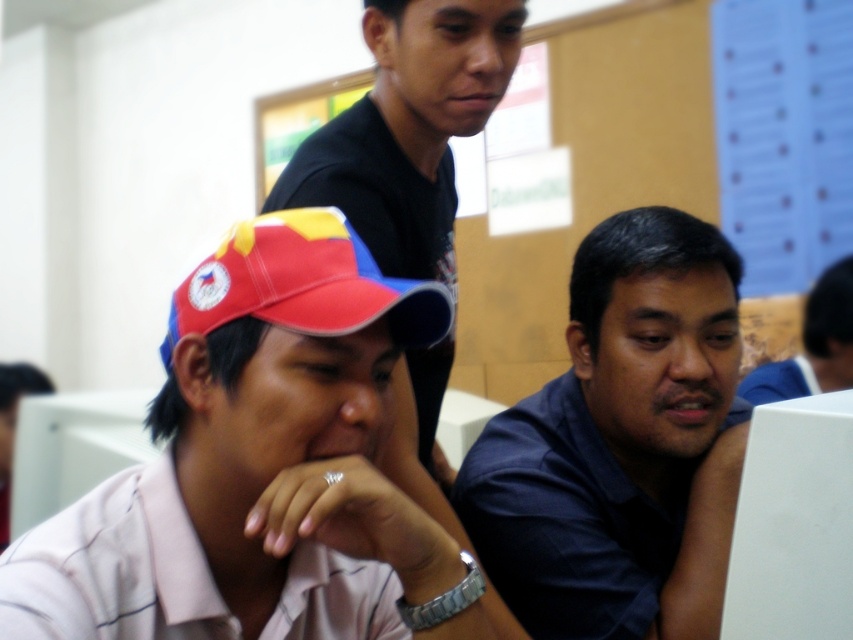
You are standing in the classroom and want to move from point A to point B. Point A is at coordinates point [604,312] and point B is at coordinates point [207,275]. Which point is closer to you?

Point B at coordinates point [207,275] is closer to you because it is nearer to the camera than point A at coordinates point [604,312].

You are standing in the classroom and need to determine which of the two shirts is smaller in size between the dark blue shirt at center and the matte black shirt at upper center. Which one is smaller?

The dark blue shirt at center is smaller in size compared to the matte black shirt at upper center.